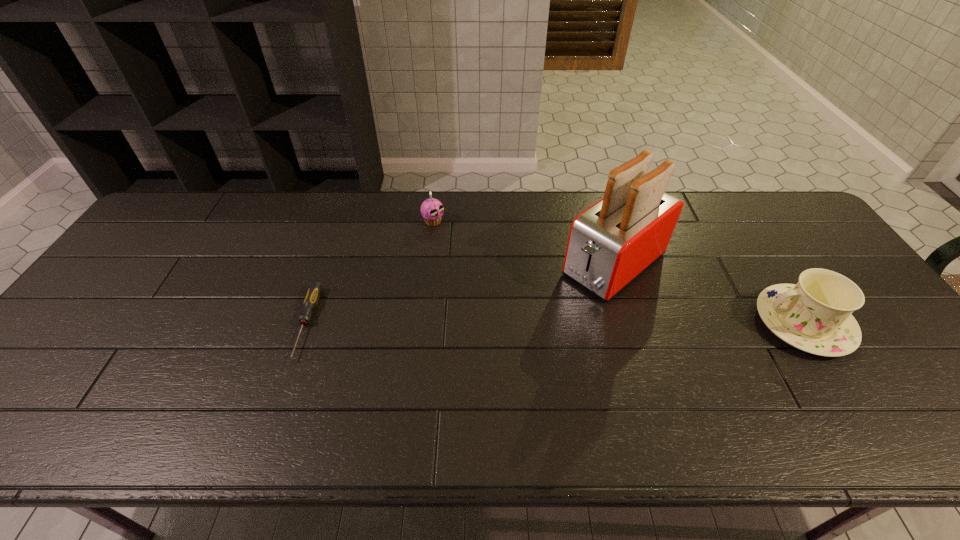
The image size is (960, 540). I want to click on free space on the desktop that is between the screwdriver and the rightmost object and is positioned on the face of the second object from left to right, so click(575, 323).

Locate an element on the screen. free space on the desktop that is between the leftmost object and the rightmost object and is positioned on the front-facing side of the tallest object is located at coordinates (540, 323).